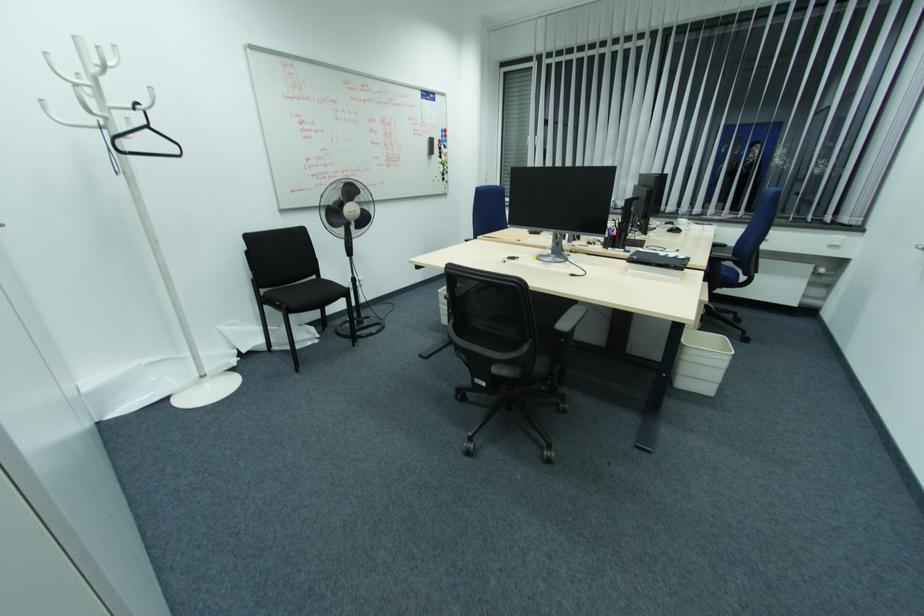
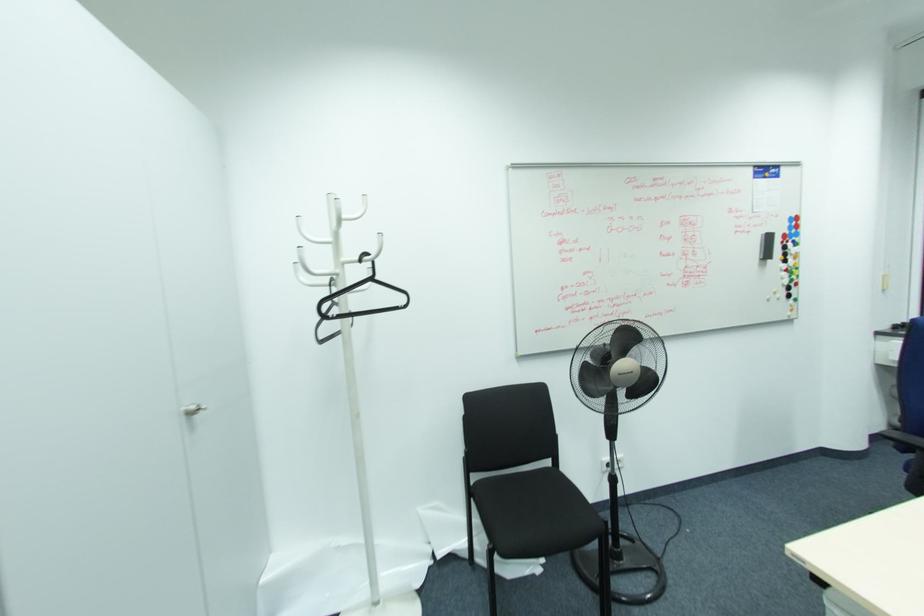
Find the pixel in the second image that matches pixel 149 128 in the first image.

(371, 280)